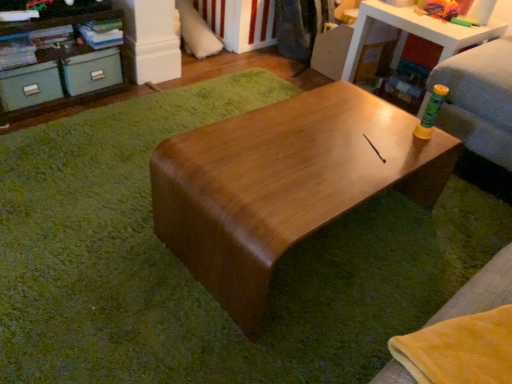
You are a GUI agent. You are given a task and a screenshot of the screen. Output one action in this format:
    pyautogui.click(x=<x>, y=<y>)
    Task: Click on the vacant space in front of shiny brown table at center, the first table from the front
    This screenshot has width=512, height=384.
    Given the screenshot: What is the action you would take?
    pyautogui.click(x=272, y=329)